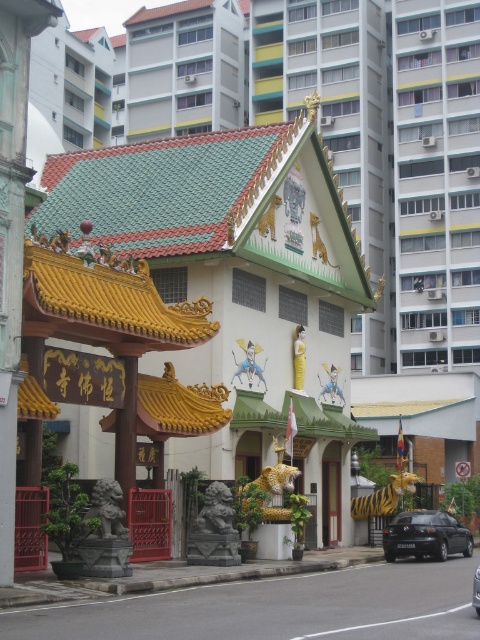
From the picture: You are a delivery person who needs to park your vehicle in a spot that is exactly 23 feet away from the black glossy car at center. Is the black matte car at lower right parked in the correct spot?

The black matte car at lower right is 23.02 feet away from the black glossy car at center, so yes, it is parked in the correct spot.

You are a visitor to the temple and want to park your car. You see two cars in the parking lot. Which car has a wider body between the black matte car at lower right and the black glossy car at center?

The black matte car at lower right has a wider body than the black glossy car at center according to the description.